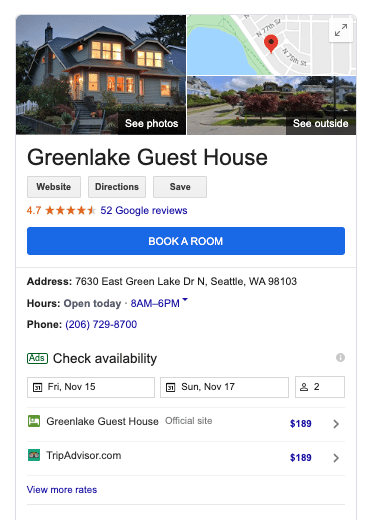
Locate an element on the screen. The image size is (376, 520). door is located at coordinates (79, 88).